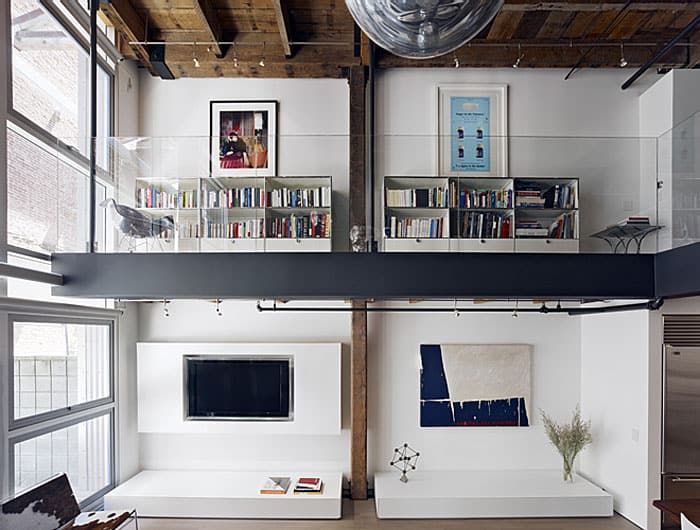
Find the location of a particular element. The width and height of the screenshot is (700, 530). fridge is located at coordinates (673, 394).